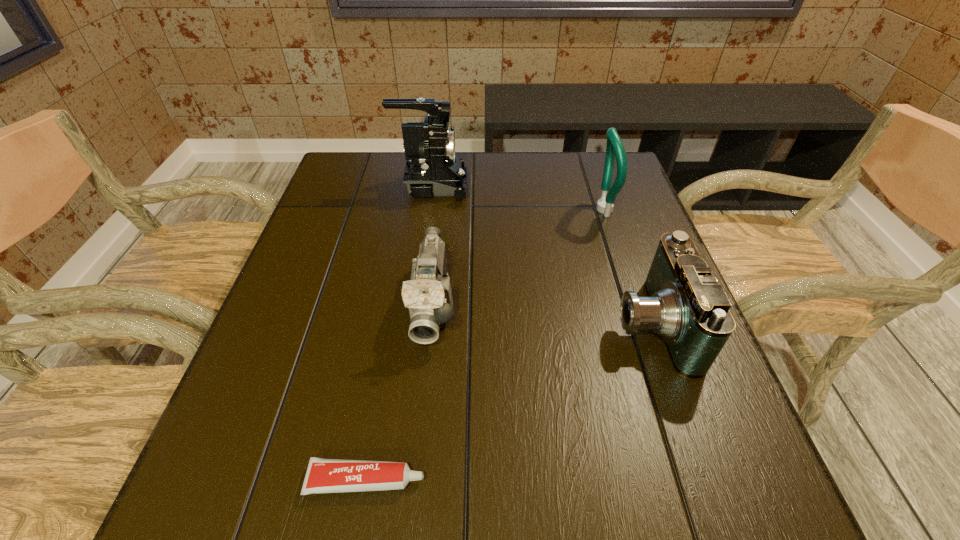
The width and height of the screenshot is (960, 540). Identify the location of blank space at the near edge of the desktop. (499, 505).

Where is `vacant region at the left edge of the desktop`? Image resolution: width=960 pixels, height=540 pixels. vacant region at the left edge of the desktop is located at coordinates (329, 319).

At what (x,y) coordinates should I click in order to perform the action: click on blank area at the right edge. Please return your answer as a coordinate pair (x, y). The height and width of the screenshot is (540, 960). Looking at the image, I should click on (617, 211).

Find the location of a particular element. vacant region at the far left corner of the desktop is located at coordinates (340, 153).

You are a GUI agent. You are given a task and a screenshot of the screen. Output one action in this format:
    pyautogui.click(x=<x>, y=<y>)
    Task: Click on the vacant area at the near left corner of the desktop
    
    Given the screenshot: What is the action you would take?
    pyautogui.click(x=297, y=484)

Image resolution: width=960 pixels, height=540 pixels. I want to click on vacant space at the far right corner, so click(x=622, y=197).

I want to click on free space between the bottle opener and the nearest object, so click(x=484, y=345).

Identify the location of empty space between the farthest camcorder and the bottle opener. (516, 198).

I want to click on vacant area that lies between the shortest object and the rightmost camcorder, so click(509, 402).

The height and width of the screenshot is (540, 960). What are the coordinates of `vacant space that's between the tallest camcorder and the bottle opener` in the screenshot? It's located at (516, 198).